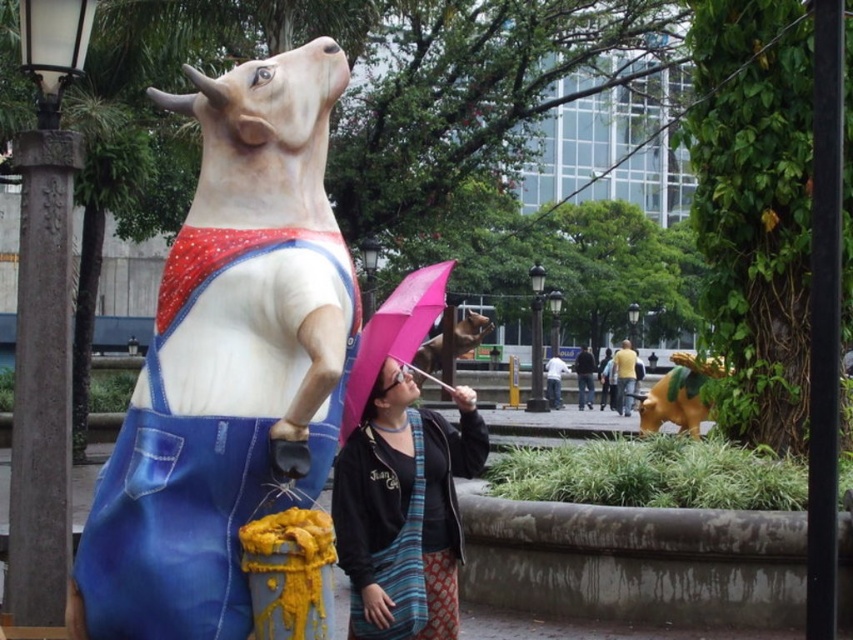
In the scene shown: You are a tourist holding a map and trying to locate the black metal lamp post at center and dark blue jeans at center in the scene. According to the map, the lamp post is to the left of the jeans. Does the map correctly show their positions?

The black metal lamp post at center is to the left of dark blue jeans at center, so the map correctly shows their positions.

You are standing at the point with coordinates point (386,556) and want to walk towards the cow statue. Will you pass by point (625,346) on your way?

Yes, because point (386,556) is in front of point (625,346), so walking towards the cow statue from point (386,556) would require passing through point (625,346).